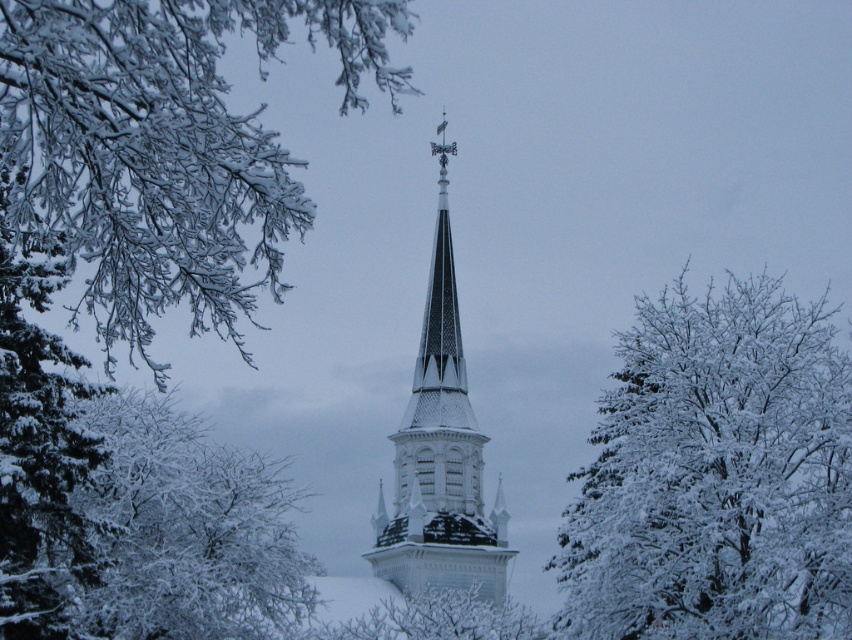
Question: In this image, where is snow-covered branches at upper left located relative to snow-covered branches at upper right?

Choices:
 (A) below
 (B) above

Answer: (B)

Question: Which is nearer to the snow-covered branches at upper left?

Choices:
 (A) snow-covered branches at upper right
 (B) white textured steeple at center
 (C) white frosty branches at lower left
 (D) snowy branches at center

Answer: (C)

Question: Does snow-covered branches at upper left have a greater width compared to white textured steeple at center?

Choices:
 (A) no
 (B) yes

Answer: (B)

Question: Among these objects, which one is farthest from the camera?

Choices:
 (A) snowy branches at center
 (B) snow-covered branches at upper left
 (C) white textured steeple at center

Answer: (C)

Question: In this image, where is snow-covered branches at upper right located relative to snowy branches at center?

Choices:
 (A) right
 (B) left

Answer: (A)

Question: Among these objects, which one is nearest to the camera?

Choices:
 (A) white frosty branches at lower left
 (B) snowy branches at center
 (C) snow-covered branches at left
 (D) white textured steeple at center

Answer: (C)